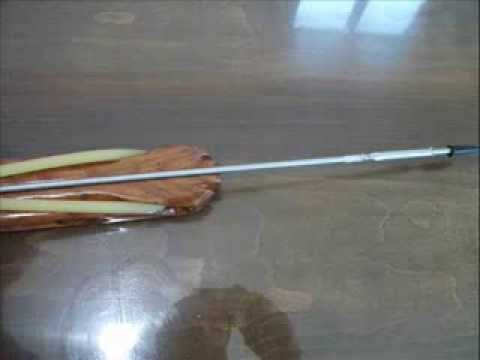
Find the location of a particular element. The height and width of the screenshot is (360, 480). shiny wood reflective table top surface is located at coordinates (359, 95), (363, 234).